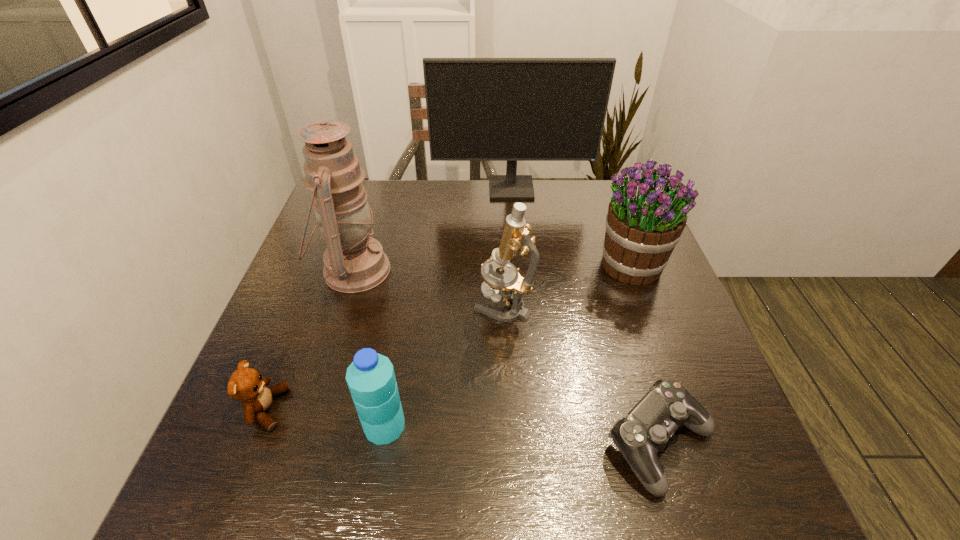
Where is `free location located 0.240m on the left of the bouquet`? free location located 0.240m on the left of the bouquet is located at coordinates (502, 265).

Locate an element on the screen. The image size is (960, 540). vacant space situated on the back of the water bottle is located at coordinates (395, 368).

Identify the location of free spot located on the front-facing side of the sixth tallest object. (369, 409).

Find the location of `free space located 0.060m on the left of the shortest object`. free space located 0.060m on the left of the shortest object is located at coordinates (571, 443).

Where is `object located in the far edge section of the desktop`? The height and width of the screenshot is (540, 960). object located in the far edge section of the desktop is located at coordinates (478, 109).

Locate an element on the screen. The width and height of the screenshot is (960, 540). object positioned at the near edge is located at coordinates (645, 430).

You are a GUI agent. You are given a task and a screenshot of the screen. Output one action in this format:
    pyautogui.click(x=<x>, y=<y>)
    Task: Click on the oil lamp that is at the left edge
    This screenshot has width=960, height=540.
    Given the screenshot: What is the action you would take?
    pyautogui.click(x=354, y=262)

The height and width of the screenshot is (540, 960). Find the location of `teddy bear that is at the left edge`. teddy bear that is at the left edge is located at coordinates (246, 384).

This screenshot has height=540, width=960. In order to click on computer monitor at the right edge in this screenshot , I will do `click(478, 109)`.

You are a GUI agent. You are given a task and a screenshot of the screen. Output one action in this format:
    pyautogui.click(x=<x>, y=<y>)
    Task: Click on the bouquet that is at the right edge
    This screenshot has width=960, height=540.
    Given the screenshot: What is the action you would take?
    pyautogui.click(x=645, y=220)